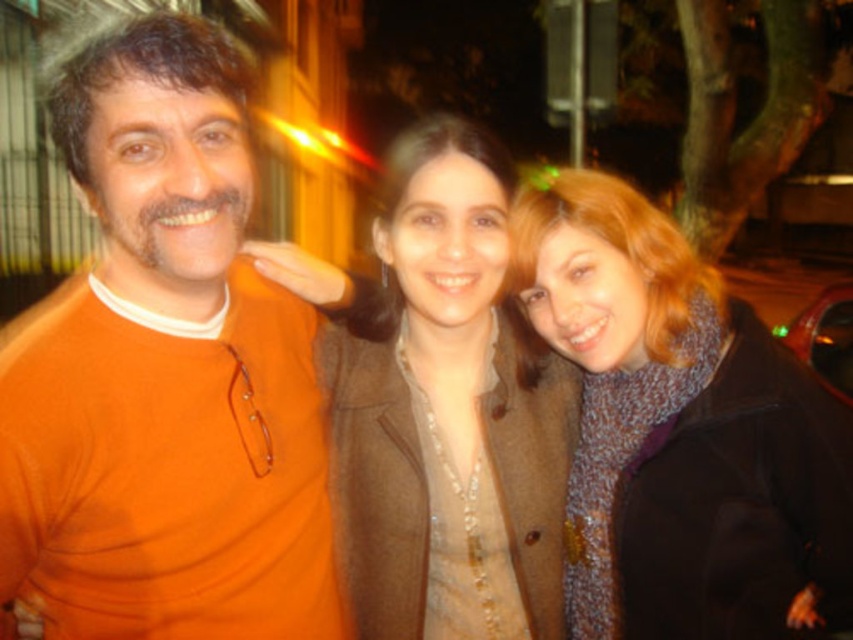
Can you confirm if orange matte sweater at left is positioned to the left of knitted scarf at center?

Indeed, orange matte sweater at left is positioned on the left side of knitted scarf at center.

Who is higher up, orange matte sweater at left or knitted scarf at center?

orange matte sweater at left is above.

Who is more distant from viewer, (28, 397) or (645, 552)?

The point (645, 552) is behind.

You are a GUI agent. You are given a task and a screenshot of the screen. Output one action in this format:
    pyautogui.click(x=<x>, y=<y>)
    Task: Click on the orange matte sweater at left
    
    Given the screenshot: What is the action you would take?
    pyautogui.click(x=167, y=378)

Between knitted scarf at center and brown woolen coat at center, which one appears on the right side from the viewer's perspective?

From the viewer's perspective, knitted scarf at center appears more on the right side.

Who is more forward, (596, 346) or (500, 419)?

Positioned in front is point (596, 346).

The height and width of the screenshot is (640, 853). I want to click on knitted scarf at center, so click(679, 429).

Does orange matte sweater at left come behind brown woolen coat at center?

No, orange matte sweater at left is in front of brown woolen coat at center.

Who is more forward, (289, 593) or (379, 560)?

Point (289, 593) is in front.

Identify the location of orange matte sweater at left. The width and height of the screenshot is (853, 640). (167, 378).